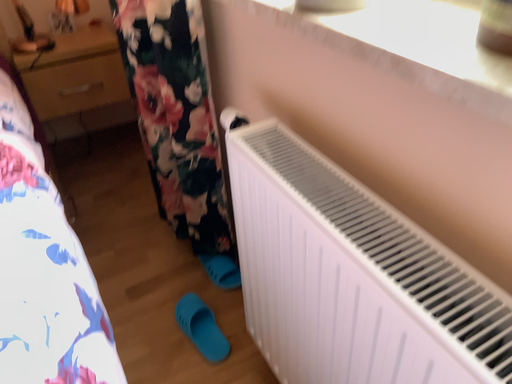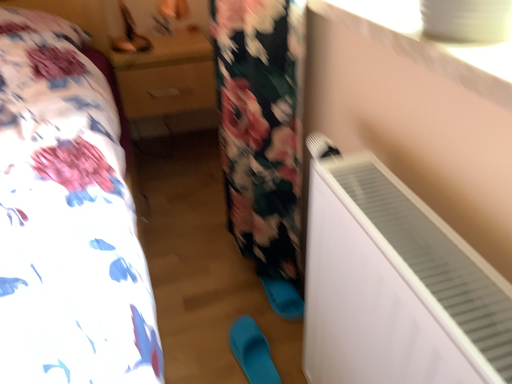
Question: Which way did the camera rotate in the video?

Choices:
 (A) rotated right
 (B) rotated left

Answer: (B)